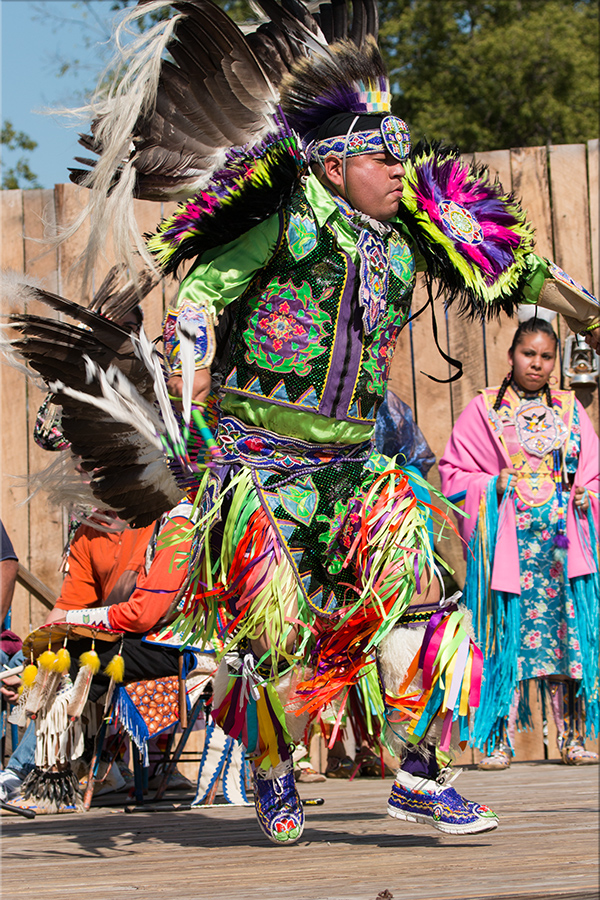
Where is `decorative feather`? decorative feather is located at coordinates (84, 699), (38, 682), (94, 673).